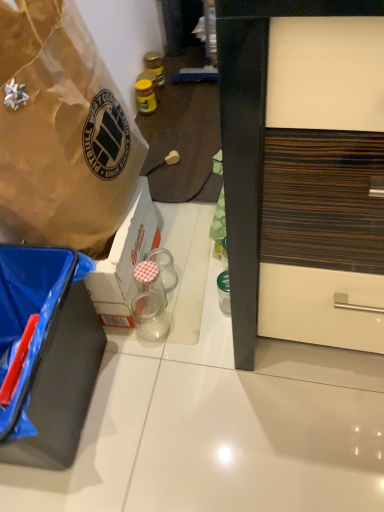
Question: Would you say transparent glass jar at center, which is counted as the 2th coffee cup, starting from the top, is a long distance from yellow glass jar at upper center, the second bottle in the back-to-front sequence?

Choices:
 (A) no
 (B) yes

Answer: (A)

Question: Can you confirm if transparent glass jar at center, which is the first coffee cup in bottom-to-top order, is taller than yellow glass jar at upper center, the 2th bottle in the front-to-back sequence?

Choices:
 (A) no
 (B) yes

Answer: (A)

Question: Does transparent glass jar at center, which is the first coffee cup in bottom-to-top order, have a smaller size compared to yellow glass jar at upper center, the 2th bottle in the front-to-back sequence?

Choices:
 (A) yes
 (B) no

Answer: (A)

Question: Is transparent glass jar at center, which is counted as the 2th coffee cup, starting from the top, thinner than yellow glass jar at upper center, the 2th bottle in the front-to-back sequence?

Choices:
 (A) yes
 (B) no

Answer: (B)

Question: Is transparent glass jar at center, which is the first coffee cup in bottom-to-top order, positioned behind yellow glass jar at upper center, which ranks as the second bottle in bottom-to-top order?

Choices:
 (A) yes
 (B) no

Answer: (B)

Question: Is transparent glass jar at center, which is the first coffee cup in bottom-to-top order, wider than yellow glass jar at upper center, the second bottle in the back-to-front sequence?

Choices:
 (A) no
 (B) yes

Answer: (B)

Question: Is matte plastic power outlet at center at the right side of clear glass jar at center, which is the second coffee cup from bottom to top?

Choices:
 (A) yes
 (B) no

Answer: (A)

Question: Is matte plastic power outlet at center smaller than clear glass jar at center, which is the second coffee cup from bottom to top?

Choices:
 (A) no
 (B) yes

Answer: (B)

Question: Does matte plastic power outlet at center appear on the left side of clear glass jar at center, which is the second coffee cup from bottom to top?

Choices:
 (A) yes
 (B) no

Answer: (B)

Question: From the image's perspective, is matte plastic power outlet at center on clear glass jar at center, which is the second coffee cup from bottom to top?

Choices:
 (A) no
 (B) yes

Answer: (B)

Question: Is matte plastic power outlet at center shorter than clear glass jar at center, arranged as the first coffee cup when viewed from the top?

Choices:
 (A) yes
 (B) no

Answer: (A)

Question: Would you say clear glass jar at center, which is the second coffee cup from bottom to top, is part of matte plastic power outlet at center's contents?

Choices:
 (A) no
 (B) yes

Answer: (A)

Question: Does black matte box at lower left, the first box in the bottom-to-top sequence, touch transparent glass jar at center, which is the first coffee cup in bottom-to-top order?

Choices:
 (A) no
 (B) yes

Answer: (A)